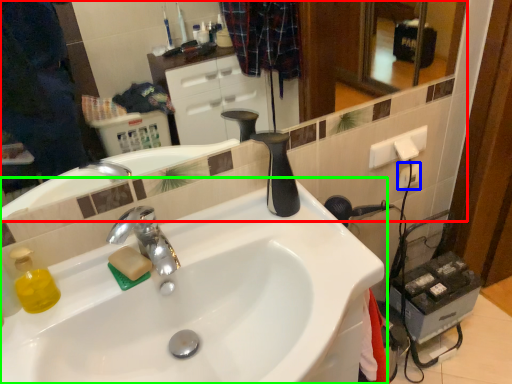
Question: Considering the real-world distances, which object is closest to mirror (highlighted by a red box)? electric outlet (highlighted by a blue box) or sink (highlighted by a green box).

Choices:
 (A) electric outlet
 (B) sink

Answer: (A)